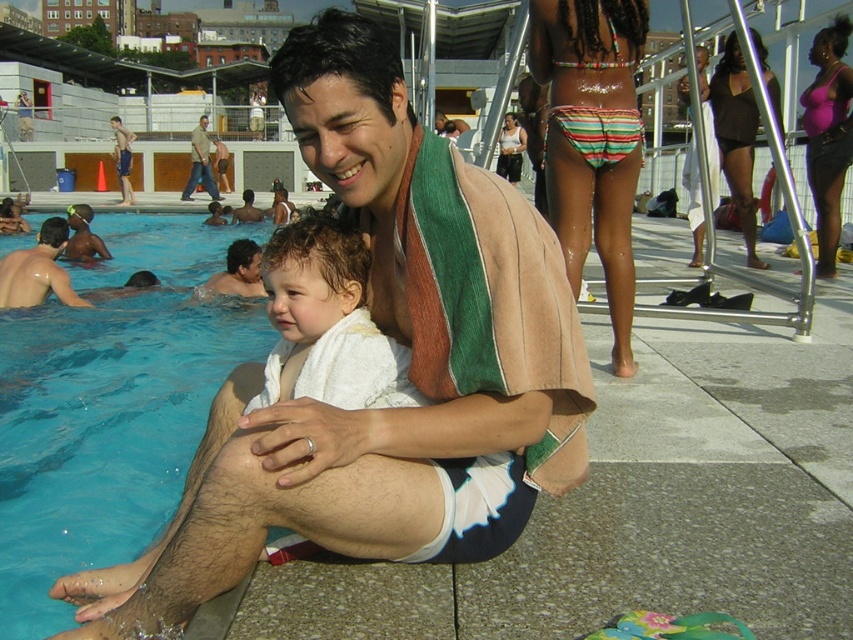
Who is positioned more to the left, beige towel at center or white towel at center?

From the viewer's perspective, white towel at center appears more on the left side.

What do you see at coordinates (408, 365) in the screenshot? I see `beige towel at center` at bounding box center [408, 365].

Which is in front, point (521, 410) or point (351, 305)?

Point (521, 410)

This screenshot has height=640, width=853. I want to click on beige towel at center, so click(408, 365).

Does white towel at center appear under shiny wet skin at left?

Yes.

This screenshot has width=853, height=640. I want to click on white towel at center, so click(x=328, y=323).

From the picture: Does beige towel at center lie behind khaki cotton pants at center?

No.

Who is taller, beige towel at center or khaki cotton pants at center?

With more height is khaki cotton pants at center.

Is point (202, 472) positioned before point (202, 161)?

Yes, point (202, 472) is closer to viewer.

At what (x,y) coordinates should I click in order to perform the action: click on beige towel at center. Please return your answer as a coordinate pair (x, y). Image resolution: width=853 pixels, height=640 pixels. Looking at the image, I should click on (408, 365).